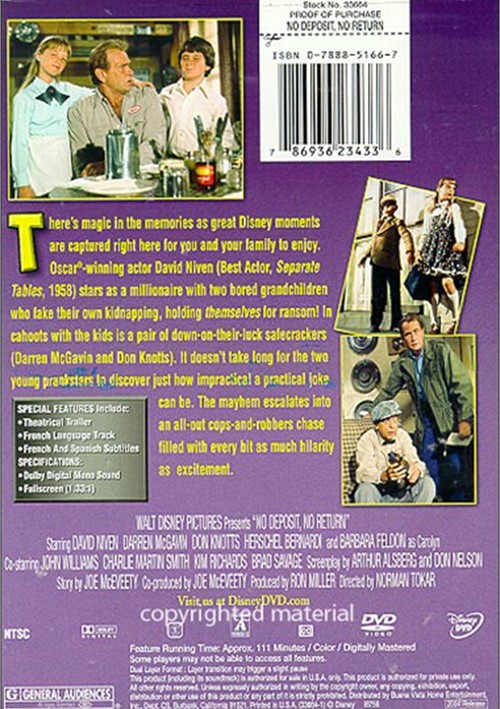
Locate an element on the screen. window is located at coordinates (419, 216).